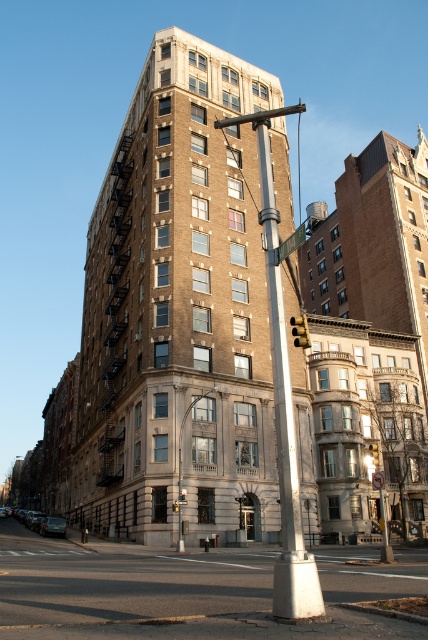
Question: Which object is the closest to the polished brass lamp post at center?

Choices:
 (A) white metallic pole at center
 (B) yellow/golden metal traffic light at center
 (C) metallic silver street sign at center

Answer: (A)

Question: Observing the image, what is the correct spatial positioning of white metallic pole at center in reference to polished brass lamp post at center?

Choices:
 (A) below
 (B) above

Answer: (B)

Question: Is white metallic pole at center closer to the viewer compared to metallic silver street sign at center?

Choices:
 (A) no
 (B) yes

Answer: (B)

Question: Is white metallic pole at center above metallic silver street sign at center?

Choices:
 (A) yes
 (B) no

Answer: (B)

Question: Which point is farther to the camera?

Choices:
 (A) [x=302, y=243]
 (B) [x=305, y=344]

Answer: (B)

Question: Based on their relative distances, which object is nearer to the white metallic pole at center?

Choices:
 (A) yellow/golden metal traffic light at center
 (B) metallic silver street sign at center
 (C) polished brass lamp post at center

Answer: (B)